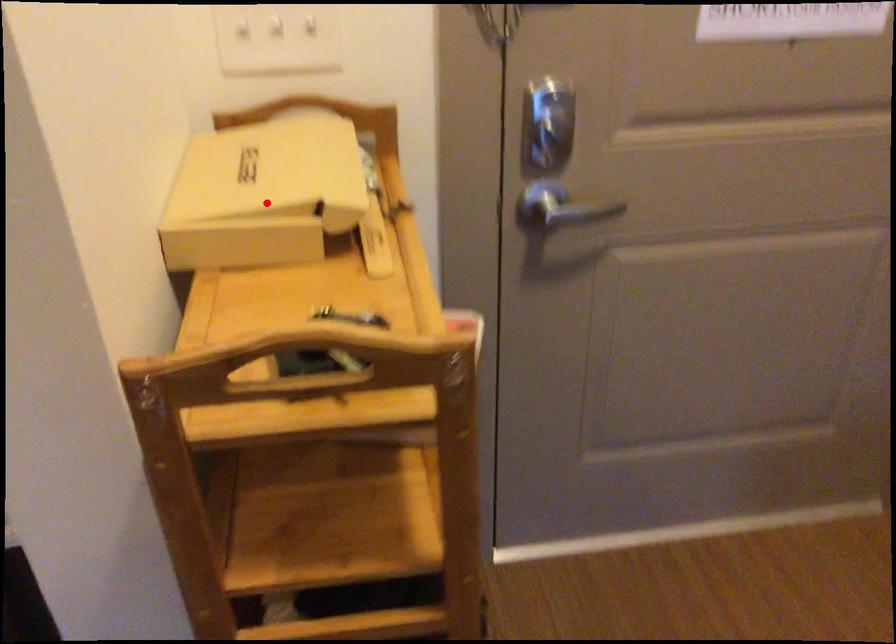
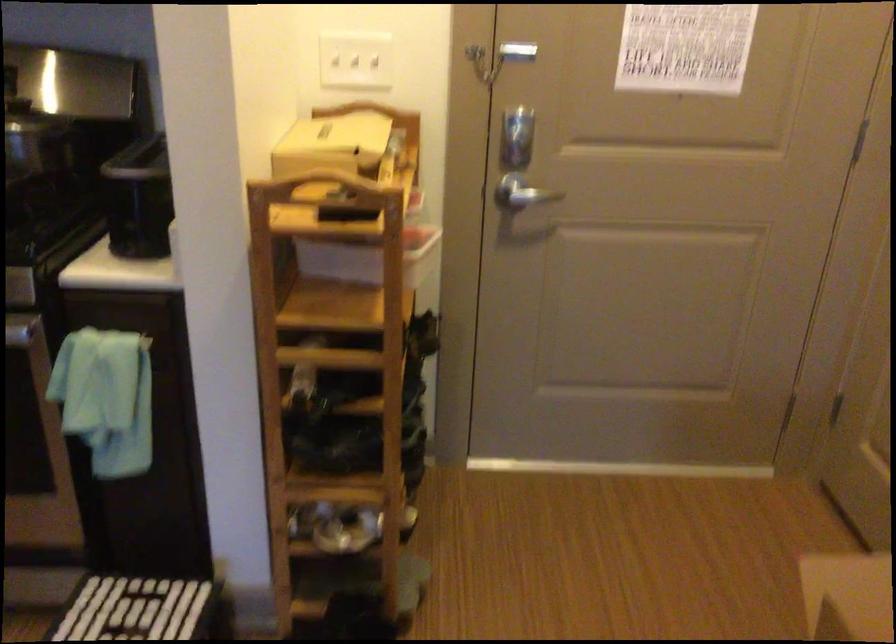
Find the pixel in the second image that matches the highlighted location in the first image.

(331, 144)